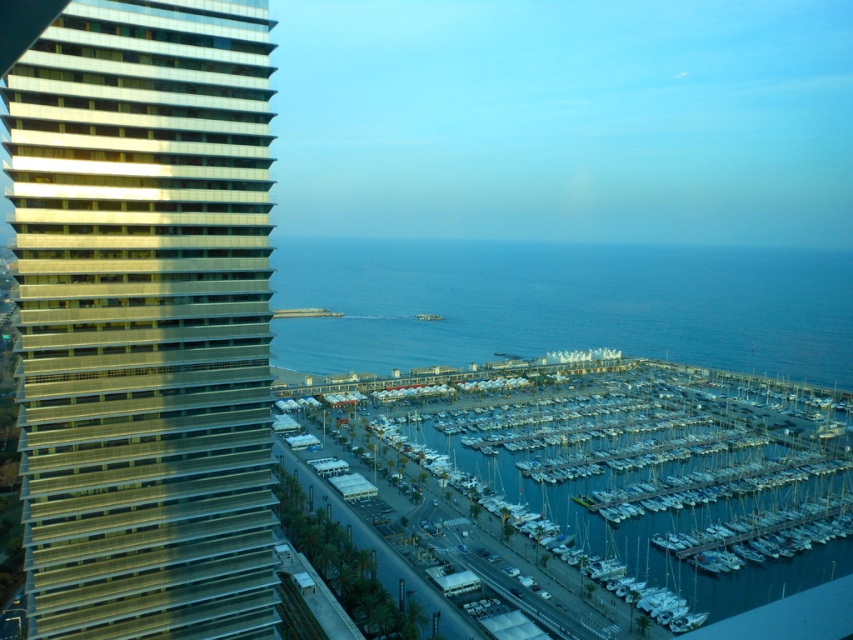
You are standing at the center of the marina and want to take a photo. You notice two points in the scene labeled as point (171, 100) and point (653, 404). Which point should you focus on first if you want to capture the closest object in your shot?

Point (171, 100) is closer to the camera than point (653, 404), so you should focus on point (171, 100) first to capture the closest object in your shot.

You are an urban planner analyzing this coastal area. The city wants to expand the marina to accommodate more boats. Based on the current layout, which area has more space that can be utilized for expansion? Please refer to the metallic glass building at left and white matte boats at center in your analysis.

The white matte boats at center occupy more space than the metallic glass building at left, so expanding the marina could utilize the area currently occupied by the metallic glass building at left which has less space.